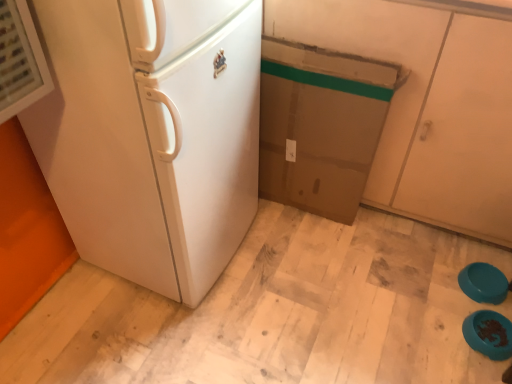
Locate an element on the screen. empty space that is in between white matte refrigerator at left and teal glossy bowls at lower right, the 2th appliance in the back-to-front sequence is located at coordinates click(330, 294).